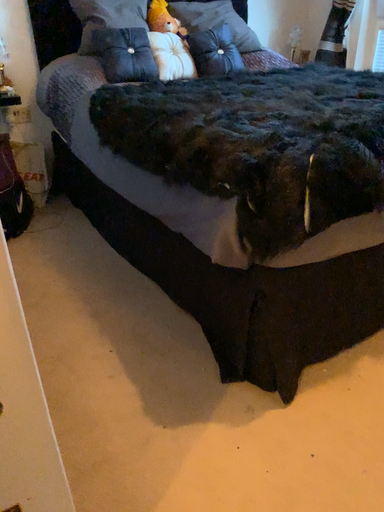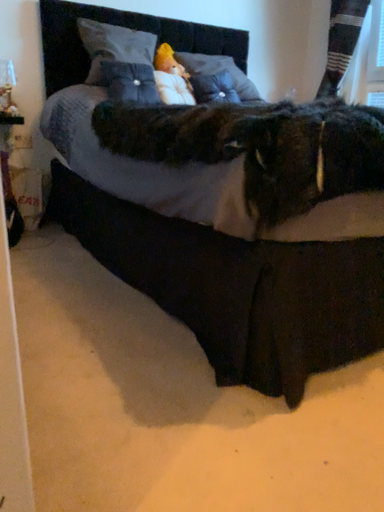
Question: How did the camera likely rotate when shooting the video?

Choices:
 (A) rotated downward
 (B) rotated upward

Answer: (B)